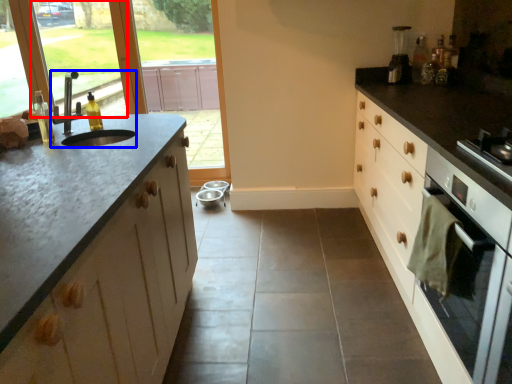
Question: Among these objects, which one is farthest to the camera, window screen (highlighted by a red box) or sink (highlighted by a blue box)?

Choices:
 (A) window screen
 (B) sink

Answer: (A)